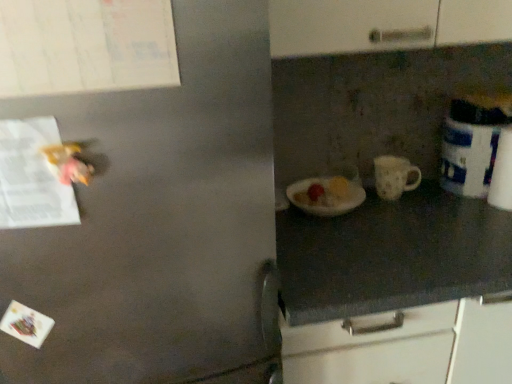
This screenshot has width=512, height=384. What do you see at coordinates (472, 144) in the screenshot? I see `white glossy canister at right` at bounding box center [472, 144].

Measure the distance between white paper at left and camera.

white paper at left and camera are 60.65 centimeters apart from each other.

Where is `white matte mug at center`? This screenshot has width=512, height=384. white matte mug at center is located at coordinates 395,176.

How many degrees apart are the facing directions of white matte mug at center and white glossy canister at right?

The angle between the facing direction of white matte mug at center and the facing direction of white glossy canister at right is 0.000707 degrees.

Considering the positions of objects white matte mug at center and white glossy canister at right in the image provided, who is more to the left, white matte mug at center or white glossy canister at right?

From the viewer's perspective, white matte mug at center appears more on the left side.

Is white matte mug at center shorter than white glossy canister at right?

Yes, white matte mug at center is shorter than white glossy canister at right.

Would you say white matte mug at center is outside white glossy canister at right?

That's correct, white matte mug at center is outside of white glossy canister at right.

Looking at the image, does white paper at left seem bigger or smaller compared to white matte mug at center?

In the image, white paper at left appears to be smaller than white matte mug at center.

Where is `paper to the left of white matte mug at center`? This screenshot has height=384, width=512. paper to the left of white matte mug at center is located at coordinates (32, 177).

From the image's perspective, is white paper at left located above white matte mug at center?

Incorrect, from the image's perspective, white paper at left is lower than white matte mug at center.

Considering the sizes of objects white paper at left and white matte mug at center in the image provided, who is shorter, white paper at left or white matte mug at center?

Standing shorter between the two is white matte mug at center.

From the image's perspective, which one is positioned lower, white matte mug at center or white paper at left?

white paper at left, from the image's perspective.

Looking at this image, is white paper at left a part of white matte mug at center?

No, white matte mug at center does not contain white paper at left.

In the scene shown: Can you see white matte mug at center touching white paper at left?

They are not placed beside each other.

Locate an element on the screen. The width and height of the screenshot is (512, 384). paper located above the white matte mug at center (from a real-world perspective) is located at coordinates (32, 177).

Does white glossy canister at right touch white matte mug at center?

No, white glossy canister at right is not in contact with white matte mug at center.

Considering the sizes of white glossy canister at right and white matte mug at center in the image, is white glossy canister at right taller or shorter than white matte mug at center?

Considering their sizes, white glossy canister at right has more height than white matte mug at center.

What's the angular difference between white glossy canister at right and white matte mug at center's facing directions?

white glossy canister at right and white matte mug at center are facing 0.000707 degrees away from each other.

From a real-world perspective, who is located lower, white glossy canister at right or white matte mug at center?

white matte mug at center, from a real-world perspective.

From a real-world perspective, is white paper at left located higher than white glossy canister at right?

Yes, from a real-world perspective, white paper at left is over white glossy canister at right

Does white paper at left appear on the right side of white glossy canister at right?

No, white paper at left is not to the right of white glossy canister at right.

Is white paper at left looking in the opposite direction of white glossy canister at right?

No, white paper at left is not facing away from white glossy canister at right.

Identify the location of paper located above the white glossy canister at right (from a real-world perspective). (32, 177).

From a real-world perspective, is white glossy canister at right on white paper at left?

No, from a real-world perspective, white glossy canister at right is not on top of white paper at left.

From the image's perspective, who appears lower, white glossy canister at right or white paper at left?

white paper at left is shown below in the image.

Considering the points (504, 102) and (2, 209), which point is behind, point (504, 102) or point (2, 209)?

Point (504, 102)

I want to click on appliance above the white matte mug at center (from a real-world perspective), so click(472, 144).

What are the coordinates of `paper in front of the white matte mug at center` in the screenshot? It's located at (32, 177).

From the image, which object appears to be nearer to white paper at left, white matte mug at center or white glossy canister at right?

Based on the image, white matte mug at center appears to be nearer to white paper at left.

From the image, which object appears to be farther from white glossy canister at right, white matte mug at center or white paper at left?

white paper at left is further to white glossy canister at right.

Based on their spatial positions, is white paper at left or white matte mug at center further from white glossy canister at right?

Based on the image, white paper at left appears to be further to white glossy canister at right.

Looking at the image, which one is located closer to white matte mug at center, white paper at left or white glossy canister at right?

Among the two, white glossy canister at right is located nearer to white matte mug at center.

Consider the image. Considering their positions, is white glossy canister at right positioned closer to white matte mug at center than white paper at left?

The object closer to white matte mug at center is white glossy canister at right.

When comparing their distances from white paper at left, does white glossy canister at right or white matte mug at center seem closer?

The object closer to white paper at left is white matte mug at center.

Find the location of a particular element. The width and height of the screenshot is (512, 384). mug between white paper at left and white glossy canister at right is located at coordinates (395, 176).